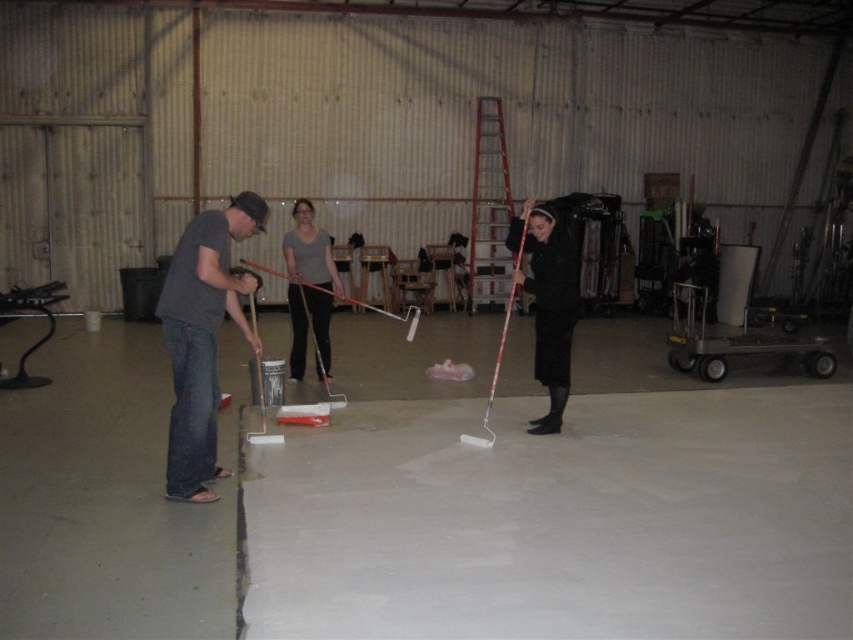
From the picture: Measure the distance between point (726,579) and camera.

The distance of point (726,579) from camera is 3.52 meters.

Is smooth concrete at center to the right of black matte coat at center from the viewer's perspective?

Correct, you'll find smooth concrete at center to the right of black matte coat at center.

Locate an element on the screen. This screenshot has height=640, width=853. smooth concrete at center is located at coordinates (560, 520).

Who is taller, gray cotton t-shirt at left or matte gray shirt at center?

Standing taller between the two is gray cotton t-shirt at left.

Between gray cotton t-shirt at left and matte gray shirt at center, which one is positioned lower?

gray cotton t-shirt at left is below.

What do you see at coordinates (202, 337) in the screenshot? I see `gray cotton t-shirt at left` at bounding box center [202, 337].

The height and width of the screenshot is (640, 853). Identify the location of gray cotton t-shirt at left. (202, 337).

Does point (415, 516) come closer to viewer compared to point (296, 285)?

Yes, point (415, 516) is in front of point (296, 285).

Between point (364, 490) and point (314, 253), which one is positioned behind?

The point (314, 253) is behind.

Who is more forward, (633, 508) or (296, 284)?

Point (633, 508) is in front.

You are a GUI agent. You are given a task and a screenshot of the screen. Output one action in this format:
    pyautogui.click(x=<x>, y=<y>)
    Task: Click on the smooth concrete at center
    The image size is (853, 640).
    Given the screenshot: What is the action you would take?
    pyautogui.click(x=560, y=520)